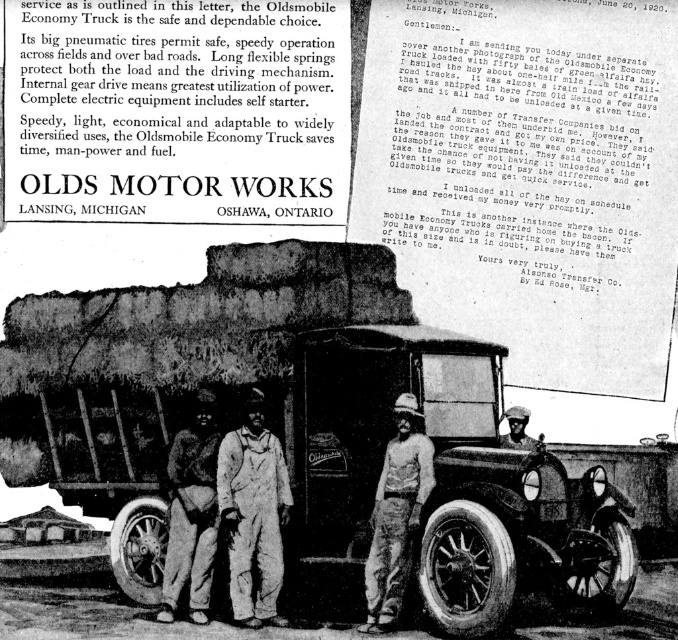
Question: Is light brown corduroy pants at center wider than black rubber tire at lower right?

Choices:
 (A) no
 (B) yes

Answer: (A)

Question: Which point is farther to the camera?

Choices:
 (A) (139, 584)
 (B) (519, 417)
 (C) (374, 584)
 (D) (5, 376)

Answer: (D)

Question: Can you confirm if shiny black tire at lower right is positioned to the right of black rubber tire at lower right?

Choices:
 (A) no
 (B) yes

Answer: (A)

Question: Is matte black truck at center bigger than dark skin textured hat at center?

Choices:
 (A) yes
 (B) no

Answer: (A)

Question: Among these objects, which one is nearest to the camera?

Choices:
 (A) black rubber tire at lower right
 (B) dark skin textured hat at center
 (C) overalls at center
 (D) light brown corduroy pants at center

Answer: (A)

Question: Which point appears farthest from the camera in this image?

Choices:
 (A) (598, 557)
 (B) (464, 512)

Answer: (A)